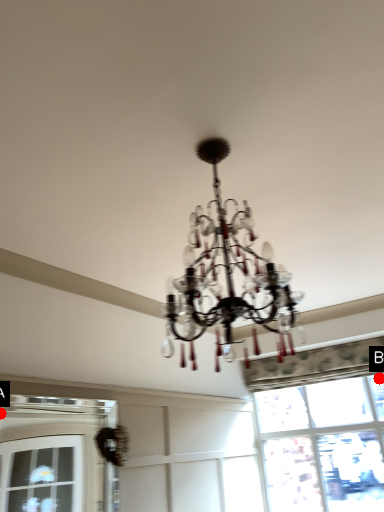
Question: Two points are circled on the image, labeled by A and B beside each circle. Which of the following is the closest to the observer?

Choices:
 (A) A is closer
 (B) B is closer

Answer: (B)